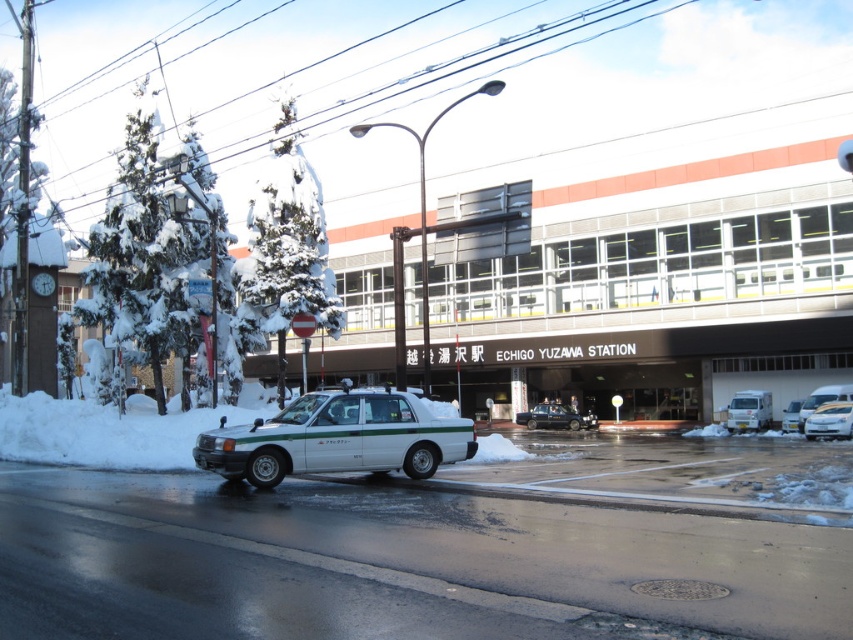
Can you confirm if white matte taxi at center is wider than white matte van at center-right?

Correct, the width of white matte taxi at center exceeds that of white matte van at center-right.

Between white matte taxi at center and white matte van at center-right, which one has more height?

Standing taller between the two is white matte van at center-right.

At what (x,y) coordinates should I click in order to perform the action: click on white matte taxi at center. Please return your answer as a coordinate pair (x, y). The width and height of the screenshot is (853, 640). Looking at the image, I should click on (337, 438).

Where is `white matte taxi at center`? white matte taxi at center is located at coordinates (337, 438).

Does point (769, 394) come behind point (793, 404)?

Yes, point (769, 394) is behind point (793, 404).

Can you confirm if white matte van at center-right is smaller than white matte sedan at center?

No.

The image size is (853, 640). What do you see at coordinates (749, 410) in the screenshot?
I see `white matte van at center-right` at bounding box center [749, 410].

Image resolution: width=853 pixels, height=640 pixels. Identify the location of white matte van at center-right. (749, 410).

Is shiny black sedan at center taller than white glossy sedan at center?

In fact, shiny black sedan at center may be shorter than white glossy sedan at center.

Is shiny black sedan at center wider than white glossy sedan at center?

No, shiny black sedan at center is not wider than white glossy sedan at center.

Identify the location of shiny black sedan at center. (555, 417).